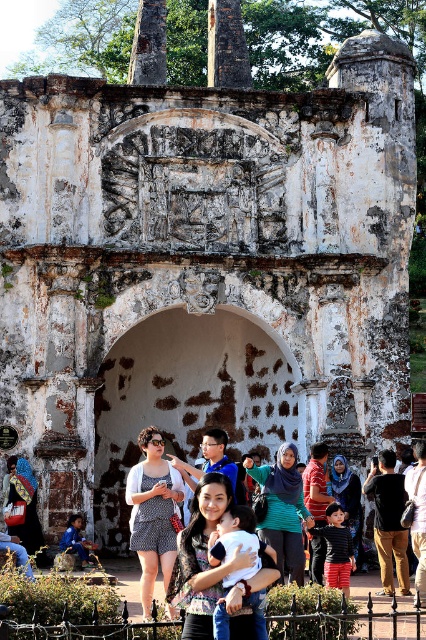
Does black cotton shirt at center lie behind striped shirt at center?

No, black cotton shirt at center is closer to the viewer.

Who is taller, black cotton shirt at center or striped shirt at center?

black cotton shirt at center is taller.

Between point (403, 497) and point (356, 547), which one is positioned in front?

Point (403, 497)

The height and width of the screenshot is (640, 426). Identify the location of black cotton shirt at center. (388, 522).

Who is more forward, (x=26, y=483) or (x=417, y=582)?

Point (x=417, y=582) is in front.

Which is above, matte black bag at center or dark brown leather jacket at center?

dark brown leather jacket at center is above.

Describe the element at coordinates (25, 500) in the screenshot. I see `matte black bag at center` at that location.

Identify the location of matte black bag at center. (25, 500).

What do you see at coordinates (236, 544) in the screenshot? I see `soft blue fabric at center` at bounding box center [236, 544].

Is soft blue fabric at center shorter than striped shirt at center?

Incorrect, soft blue fabric at center's height does not fall short of striped shirt at center's.

Between point (222, 518) and point (334, 467), which one is positioned behind?

Positioned behind is point (334, 467).

Find the location of `soft blue fabric at center`. soft blue fabric at center is located at coordinates (236, 544).